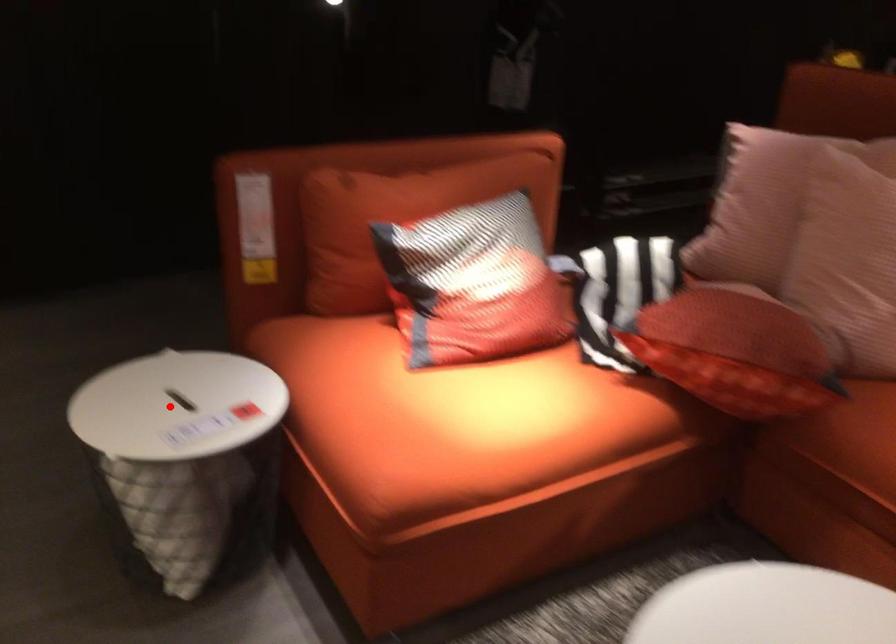
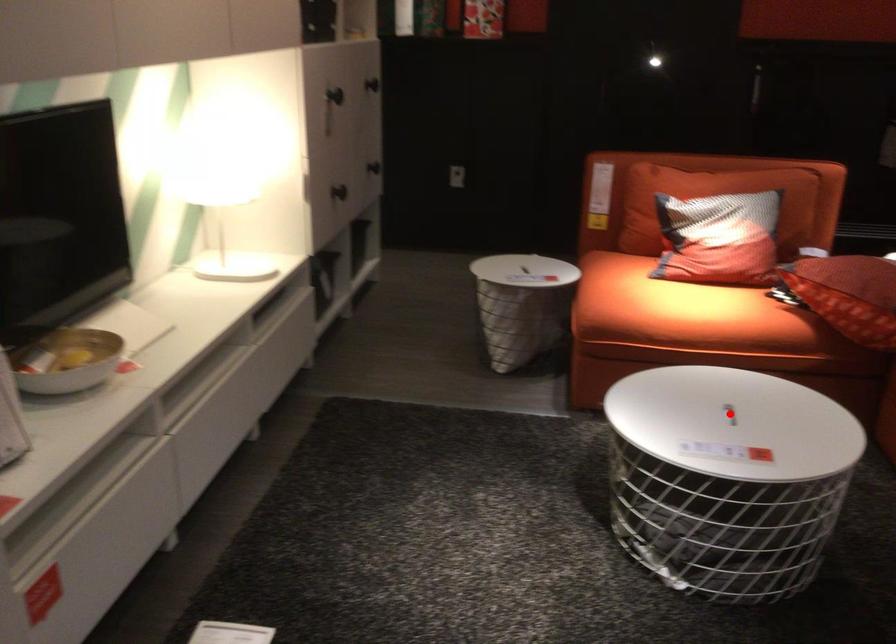
I am providing you with two images of the same scene from different viewpoints. A red point is marked on the first image and another point is marked on the second image. Does the point marked in image1 correspond to the same location as the one in image2?

No